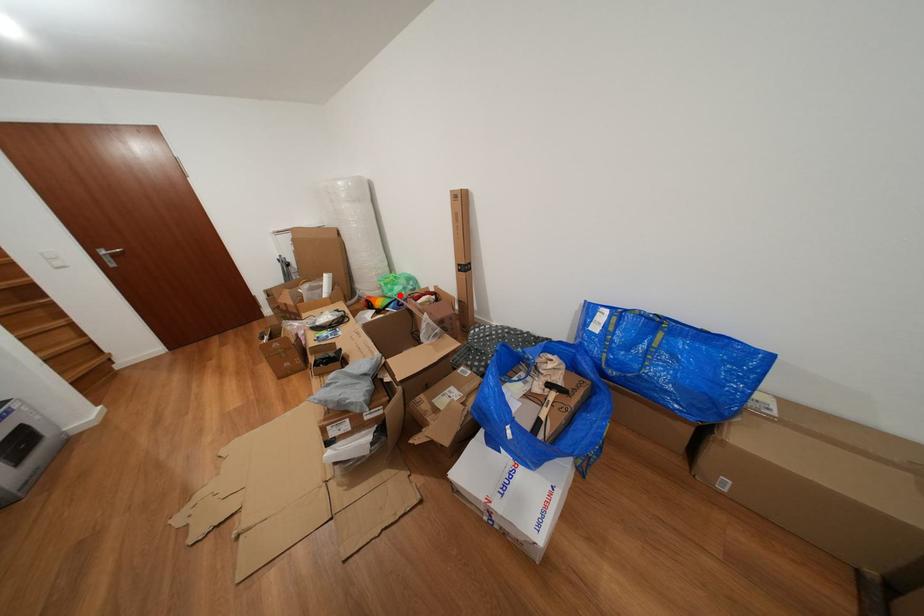
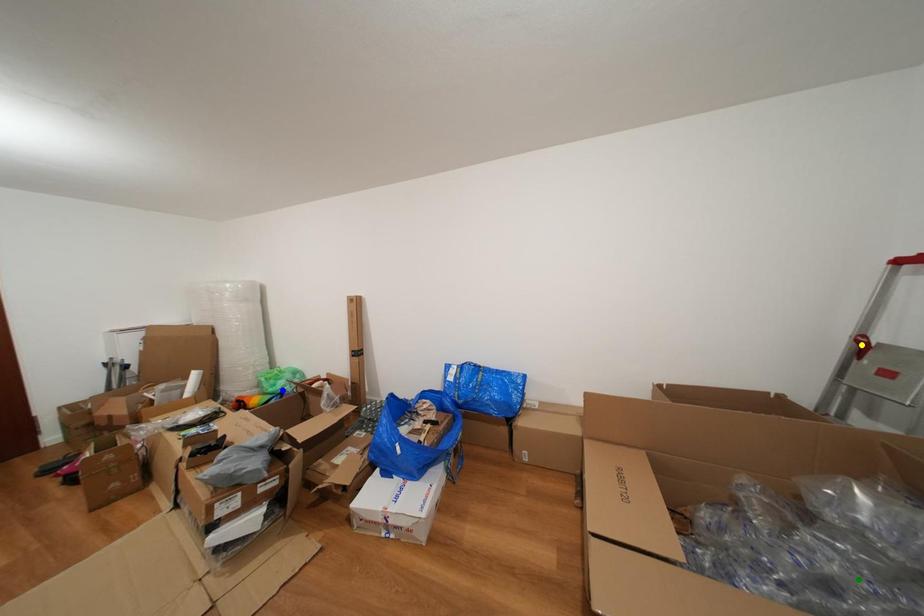
Question: I am providing you with two images of the same scene from different viewpoints. A red point is marked on the first image. You are given multiple points on the second image. Which spot in image 2 lines up with the point in image 1?

Choices:
 (A) yellow point
 (B) green point
 (C) blue point

Answer: (C)